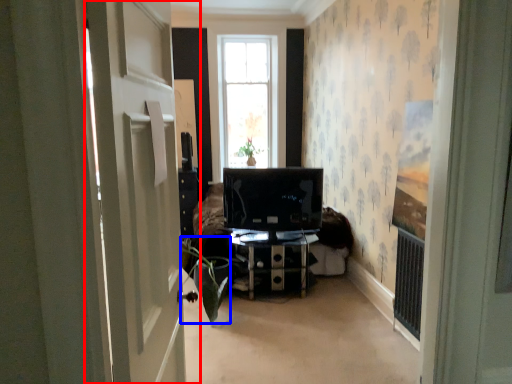
Question: Which of the following is the farthest to the observer, door (highlighted by a red box) or plant (highlighted by a blue box)?

Choices:
 (A) door
 (B) plant

Answer: (B)